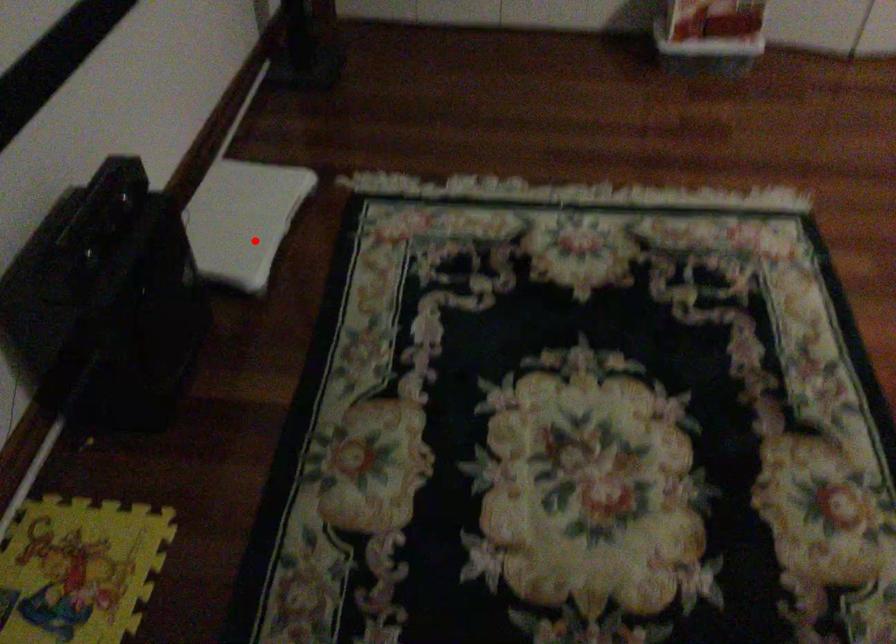
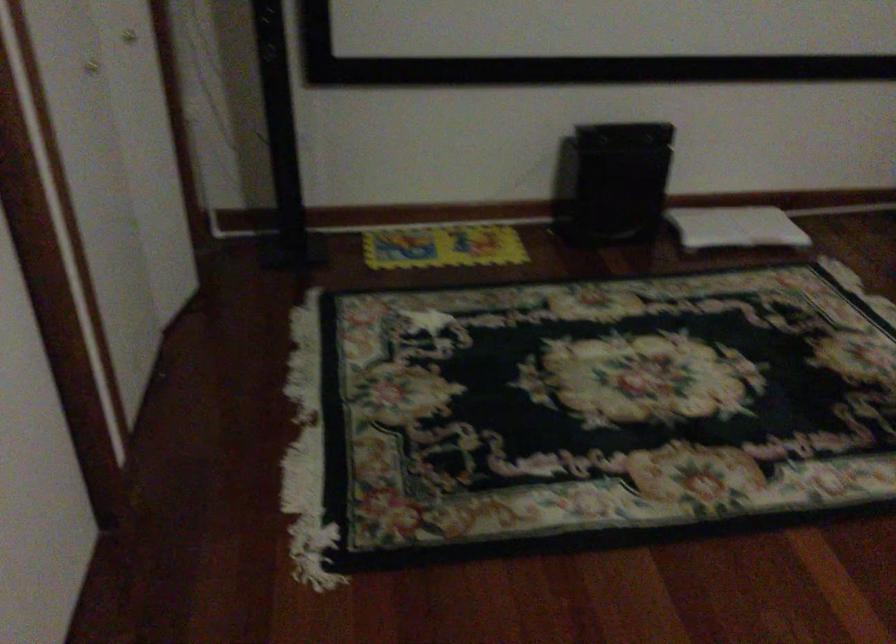
Question: I am providing you with two images of the same scene from different viewpoints. A red point is shown in image1. For the corresponding object point in image2, is it positioned nearer or farther from the camera?

Choices:
 (A) Nearer
 (B) Farther

Answer: (B)